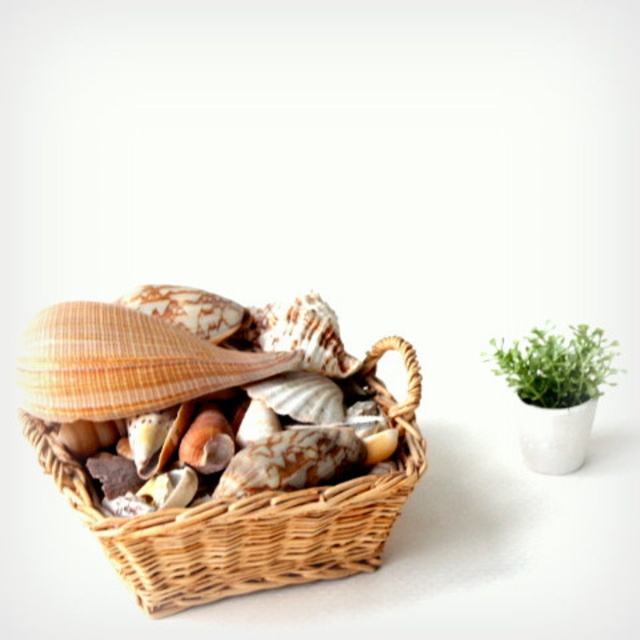
Between woven wood basket at left and orange striped seashell at center, which one appears on the right side from the viewer's perspective?

Positioned to the right is woven wood basket at left.

Does woven wood basket at left have a greater height compared to orange striped seashell at center?

Indeed, woven wood basket at left has a greater height compared to orange striped seashell at center.

Find the location of a particular element. The height and width of the screenshot is (640, 640). woven wood basket at left is located at coordinates (252, 516).

Where is `woven wood basket at left`? The width and height of the screenshot is (640, 640). woven wood basket at left is located at coordinates (252, 516).

Which of these two, woven wood basket at left or green leafy plant in pot at right, stands taller?

With more height is woven wood basket at left.

Can you confirm if woven wood basket at left is positioned to the right of green leafy plant in pot at right?

In fact, woven wood basket at left is to the left of green leafy plant in pot at right.

Find the location of `woven wood basket at left`. woven wood basket at left is located at coordinates (252, 516).

Who is shorter, orange striped seashell at center or green leafy plant in pot at right?

green leafy plant in pot at right is shorter.

Can you confirm if orange striped seashell at center is positioned to the right of green leafy plant in pot at right?

No, orange striped seashell at center is not to the right of green leafy plant in pot at right.

Measure the distance between orange striped seashell at center and camera.

35.52 inches

What are the coordinates of `orange striped seashell at center` in the screenshot? It's located at (124, 364).